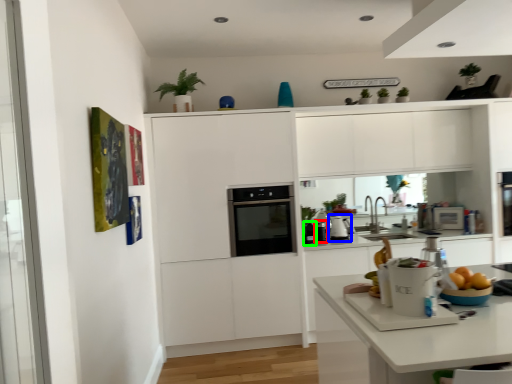
Question: Which is nearer to the appliance (highlighted by a red box)? appliance (highlighted by a blue box) or appliance (highlighted by a green box).

Choices:
 (A) appliance
 (B) appliance

Answer: (B)